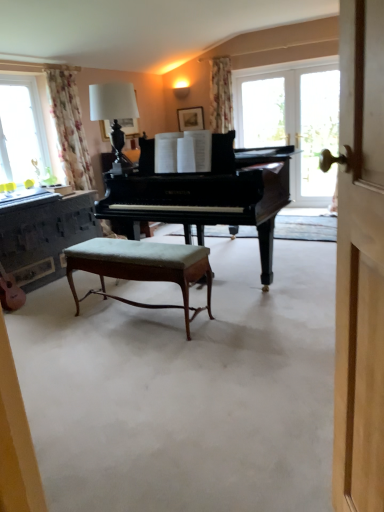
Describe the element at coordinates (204, 194) in the screenshot. The image size is (384, 512). I see `shiny black piano at center` at that location.

Locate an element on the screen. The width and height of the screenshot is (384, 512). transparent glass door at right is located at coordinates [x=293, y=120].

Describe the element at coordinates (45, 236) in the screenshot. I see `wooden dresser at left` at that location.

What do you see at coordinates (191, 118) in the screenshot? I see `wooden picture frame at upper center` at bounding box center [191, 118].

In order to click on shiny black piano at center in this screenshot , I will do click(204, 194).

Does wooden picture frame at upper center have a lesser height compared to floral fabric curtain at left?

Yes, wooden picture frame at upper center is shorter than floral fabric curtain at left.

Between wooden picture frame at upper center and floral fabric curtain at left, which one appears on the left side from the viewer's perspective?

From the viewer's perspective, floral fabric curtain at left appears more on the left side.

Consider the image. From a real-world perspective, who is located lower, wooden picture frame at upper center or floral fabric curtain at left?

floral fabric curtain at left is physically lower.

Is wooden picture frame at upper center positioned before floral fabric curtain at left?

No.

Is wooden dresser at left beside wooden picture frame at upper center?

No, wooden dresser at left is not with wooden picture frame at upper center.

What's the angular difference between wooden dresser at left and wooden picture frame at upper center's facing directions?

89.8 degrees.

Consider the image. In terms of width, does wooden dresser at left look wider or thinner when compared to wooden picture frame at upper center?

wooden dresser at left is wider than wooden picture frame at upper center.

Does wooden dresser at left have a smaller size compared to wooden picture frame at upper center?

Actually, wooden dresser at left might be larger than wooden picture frame at upper center.

Based on their sizes in the image, would you say wooden stool at center is bigger or smaller than wooden picture frame at upper center?

In the image, wooden stool at center appears to be larger than wooden picture frame at upper center.

Considering their positions, is wooden stool at center located in front of or behind wooden picture frame at upper center?

wooden stool at center is positioned closer to the viewer than wooden picture frame at upper center.

From a real-world perspective, who is located lower, wooden stool at center or wooden picture frame at upper center?

wooden stool at center is physically lower.

Which object is wider, wooden stool at center or wooden picture frame at upper center?

wooden stool at center.

Which is in front, point (77, 231) or point (336, 149)?

The point (77, 231) is closer to the camera.

Where is `window screen that is above the wooden dresser at left (from the image's perspective)`? This screenshot has width=384, height=512. window screen that is above the wooden dresser at left (from the image's perspective) is located at coordinates (293, 120).

Between wooden dresser at left and transparent glass door at right, which one has larger width?

With larger width is wooden dresser at left.

Could transparent glass door at right be considered to be inside wooden dresser at left?

No, transparent glass door at right is not a part of wooden dresser at left.

Considering the sizes of transparent glass door at right and wooden stool at center in the image, is transparent glass door at right bigger or smaller than wooden stool at center?

Considering their sizes, transparent glass door at right takes up less space than wooden stool at center.

Who is taller, transparent glass door at right or wooden stool at center?

transparent glass door at right is taller.

Which is more to the left, transparent glass door at right or wooden stool at center?

wooden stool at center.

From the image's perspective, which one is positioned lower, transparent glass door at right or wooden stool at center?

From the image's view, wooden stool at center is below.

In the image, is wooden stool at center positioned in front of or behind transparent glass door at right?

wooden stool at center is positioned closer to the viewer than transparent glass door at right.

From the image's perspective, between wooden stool at center and transparent glass door at right, who is located below?

wooden stool at center is shown below in the image.

Is wooden stool at center to the left or to the right of transparent glass door at right in the image?

In the image, wooden stool at center appears on the left side of transparent glass door at right.

Looking at this image, from a real-world perspective, which is physically below, wooden stool at center or transparent glass door at right?

wooden stool at center is physically lower.

Relative to shiny black piano at center, is wooden picture frame at upper center in front or behind?

Clearly, wooden picture frame at upper center is behind shiny black piano at center.

In the scene shown: Could you tell me if wooden picture frame at upper center is turned towards shiny black piano at center?

No.

Is wooden picture frame at upper center bigger than shiny black piano at center?

No, wooden picture frame at upper center is not bigger than shiny black piano at center.

Image resolution: width=384 pixels, height=512 pixels. What are the coordinates of `curtain in front of the wooden picture frame at upper center` in the screenshot? It's located at tap(69, 128).

The width and height of the screenshot is (384, 512). In order to click on picture frame that is on the right side of wooden dresser at left in this screenshot , I will do `click(191, 118)`.

Considering their positions, is wooden stool at center positioned further to floral fabric curtain at left than shiny black piano at center?

wooden stool at center lies further to floral fabric curtain at left than the other object.

Which object lies further to the anchor point green fabric stool at center, transparent glass door at right or wooden stool at center?

transparent glass door at right is positioned further to the anchor green fabric stool at center.

Estimate the real-world distances between objects in this image. Which object is closer to green fabric stool at center, wooden stool at center or shiny black piano at center?

wooden stool at center is closer to green fabric stool at center.

From the image, which object appears to be farther from floral fabric curtain at left, wooden dresser at left or shiny black piano at center?

shiny black piano at center is further to floral fabric curtain at left.

From the image, which object appears to be nearer to green fabric stool at center, wooden dresser at left or transparent glass door at right?

wooden dresser at left.

Estimate the real-world distances between objects in this image. Which object is closer to shiny black piano at center, wooden dresser at left or wooden stool at center?

wooden stool at center is positioned closer to the anchor shiny black piano at center.

From the image, which object appears to be nearer to wooden stool at center, wooden picture frame at upper center or shiny black piano at center?

shiny black piano at center is positioned closer to the anchor wooden stool at center.

When comparing their distances from transparent glass door at right, does wooden dresser at left or wooden stool at center seem further?

wooden stool at center is further to transparent glass door at right.

This screenshot has height=512, width=384. Identify the location of curtain between shiny black piano at center and wooden picture frame at upper center from front to back. (69, 128).

This screenshot has width=384, height=512. What are the coordinates of `piano located between green fabric stool at center and floral fabric curtain at left in the depth direction` in the screenshot? It's located at pos(204,194).

You are a GUI agent. You are given a task and a screenshot of the screen. Output one action in this format:
    pyautogui.click(x=<x>, y=<y>)
    Task: Click on the stool between wooden stool at center and shiny black piano at center along the z-axis
    Image resolution: width=384 pixels, height=512 pixels.
    Given the screenshot: What is the action you would take?
    pyautogui.click(x=142, y=268)

The width and height of the screenshot is (384, 512). Find the location of `stool between wooden stool at center and wooden picture frame at upper center along the z-axis`. stool between wooden stool at center and wooden picture frame at upper center along the z-axis is located at coordinates (142, 268).